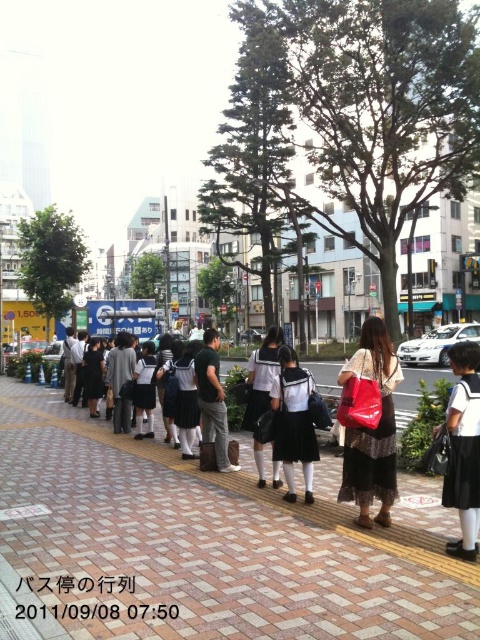
Can you confirm if brick pavement at center is smaller than white uniform at center?

Incorrect, brick pavement at center is not smaller in size than white uniform at center.

Which of these two, brick pavement at center or white uniform at center, stands shorter?

brick pavement at center

Who is more distant from viewer, [29,468] or [294,397]?

The point [29,468] is behind.

Locate an element on the screen. This screenshot has height=640, width=480. brick pavement at center is located at coordinates coord(208,541).

Who is positioned more to the left, brick pavement at center or dark gray fabric jacket at center?

Positioned to the left is brick pavement at center.

Can you confirm if brick pavement at center is positioned below dark gray fabric jacket at center?

Yes.

Find the location of a particular element. The image size is (480, 640). brick pavement at center is located at coordinates pos(208,541).

Is point (101, 573) closer to camera compared to point (367, 348)?

That is True.

How distant is brick pavement at center from matte black dress at center?

brick pavement at center and matte black dress at center are 6.92 meters apart.

Locate an element on the screen. Image resolution: width=480 pixels, height=640 pixels. brick pavement at center is located at coordinates (208, 541).